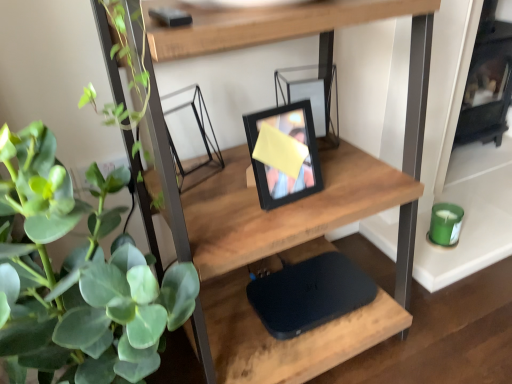
Question: Is green matte plant at left closer to the viewer compared to black matte laptop at center?

Choices:
 (A) no
 (B) yes

Answer: (B)

Question: From the image's perspective, is green matte plant at left below black matte laptop at center?

Choices:
 (A) no
 (B) yes

Answer: (A)

Question: Considering the relative sizes of green matte plant at left and black matte laptop at center in the image provided, is green matte plant at left shorter than black matte laptop at center?

Choices:
 (A) no
 (B) yes

Answer: (A)

Question: Is green matte plant at left to the left of black matte laptop at center from the viewer's perspective?

Choices:
 (A) no
 (B) yes

Answer: (B)

Question: Could you tell me if green matte plant at left is turned towards black matte laptop at center?

Choices:
 (A) no
 (B) yes

Answer: (A)

Question: From a real-world perspective, is black matte laptop at center physically located above or below black matte picture frame at center?

Choices:
 (A) above
 (B) below

Answer: (B)

Question: Is black matte laptop at center wider or thinner than black matte picture frame at center?

Choices:
 (A) thin
 (B) wide

Answer: (B)

Question: Considering the relative positions of black matte laptop at center and black matte picture frame at center in the image provided, is black matte laptop at center to the left or to the right of black matte picture frame at center?

Choices:
 (A) left
 (B) right

Answer: (B)

Question: From their relative heights in the image, would you say black matte laptop at center is taller or shorter than black matte picture frame at center?

Choices:
 (A) tall
 (B) short

Answer: (B)

Question: From a real-world perspective, relative to green matte plant at left, is wooden shelf at center vertically above or below?

Choices:
 (A) below
 (B) above

Answer: (B)

Question: Considering the positions of wooden shelf at center and green matte plant at left in the image, is wooden shelf at center taller or shorter than green matte plant at left?

Choices:
 (A) short
 (B) tall

Answer: (B)

Question: Is wooden shelf at center in front of or behind green matte plant at left in the image?

Choices:
 (A) front
 (B) behind

Answer: (B)

Question: Based on their positions, is wooden shelf at center located to the left or right of green matte plant at left?

Choices:
 (A) left
 (B) right

Answer: (B)

Question: Is green matte plant at left wider or thinner than wooden shelf at center?

Choices:
 (A) wide
 (B) thin

Answer: (B)

Question: From a real-world perspective, is green matte plant at left above or below wooden shelf at center?

Choices:
 (A) below
 (B) above

Answer: (A)